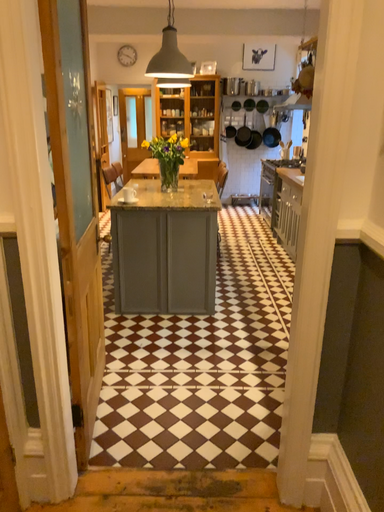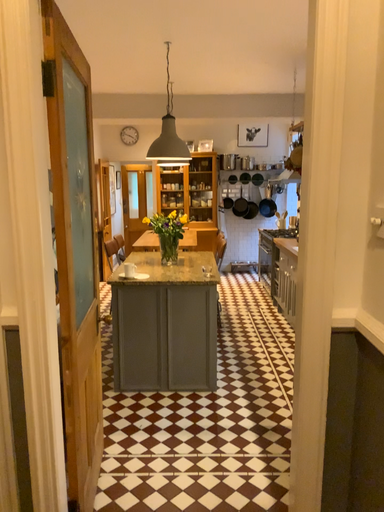
Question: How did the camera likely rotate when shooting the video?

Choices:
 (A) rotated downward
 (B) rotated upward

Answer: (B)